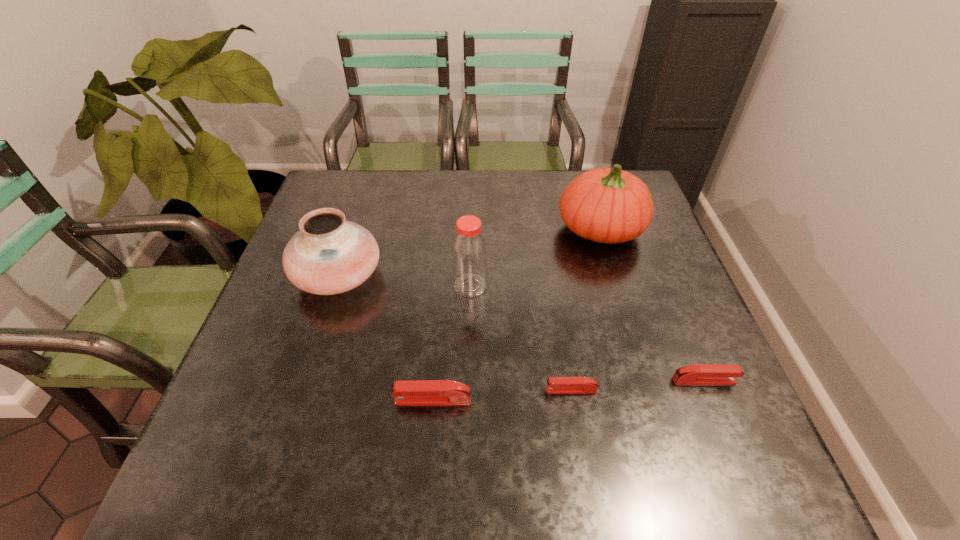
Find the location of a particular element. The width and height of the screenshot is (960, 540). vacant space that satisfies the following two spatial constraints: 1. on the front side of the bottle; 2. on the front-facing side of the nearest stapler is located at coordinates (468, 400).